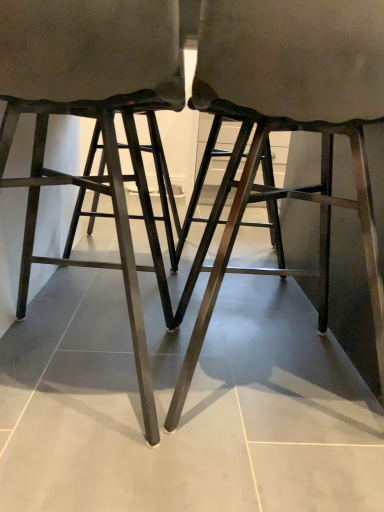
Question: Is metallic dark brown stool at center, positioned as the 2th stool in left-to-right order, wider or thinner than matte black stool at center, the 1th stool in the left-to-right sequence?

Choices:
 (A) wide
 (B) thin

Answer: (A)

Question: Considering the positions of metallic dark brown stool at center, positioned as the 2th stool in left-to-right order, and matte black stool at center, positioned as the second stool in right-to-left order, in the image, is metallic dark brown stool at center, positioned as the 2th stool in left-to-right order, taller or shorter than matte black stool at center, positioned as the second stool in right-to-left order,?

Choices:
 (A) tall
 (B) short

Answer: (A)

Question: Considering the positions of metallic dark brown stool at center, positioned as the 2th stool in left-to-right order, and matte black stool at center, positioned as the second stool in right-to-left order, in the image, is metallic dark brown stool at center, positioned as the 2th stool in left-to-right order, bigger or smaller than matte black stool at center, positioned as the second stool in right-to-left order,?

Choices:
 (A) big
 (B) small

Answer: (A)

Question: Is matte black stool at center, positioned as the second stool in right-to-left order, spatially inside metallic dark brown stool at center, positioned as the 2th stool in left-to-right order, or outside of it?

Choices:
 (A) inside
 (B) outside

Answer: (B)

Question: Does point (16, 121) appear closer or farther from the camera than point (301, 130)?

Choices:
 (A) farther
 (B) closer

Answer: (A)

Question: Considering the relative positions of matte black stool at center, positioned as the second stool in right-to-left order, and metallic dark brown stool at center, positioned as the 2th stool in left-to-right order, in the image provided, is matte black stool at center, positioned as the second stool in right-to-left order, to the left or to the right of metallic dark brown stool at center, positioned as the 2th stool in left-to-right order,?

Choices:
 (A) left
 (B) right

Answer: (A)

Question: From a real-world perspective, is matte black stool at center, positioned as the second stool in right-to-left order, positioned above or below metallic dark brown stool at center, positioned as the 2th stool in left-to-right order?

Choices:
 (A) above
 (B) below

Answer: (B)